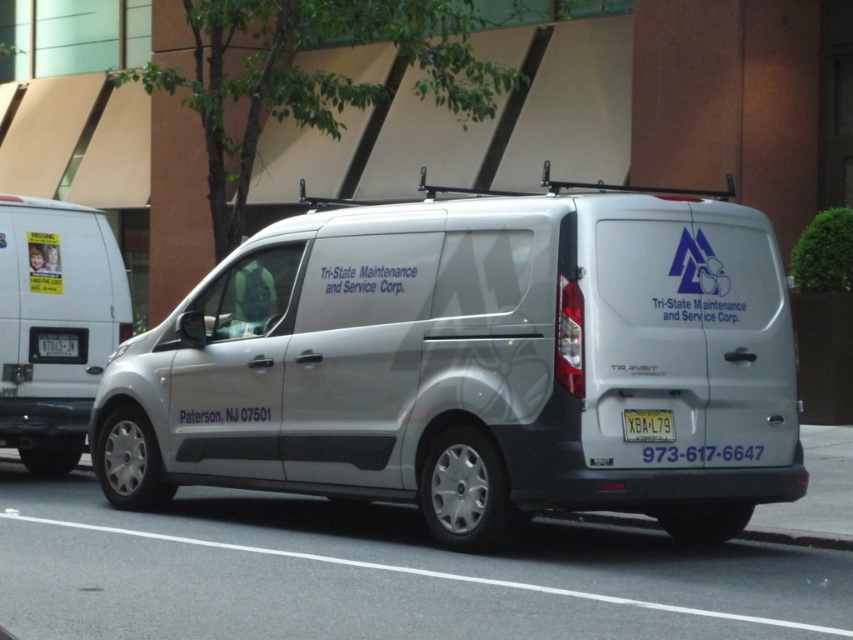
Who is more forward, (x=630, y=228) or (x=84, y=234)?

Point (x=630, y=228) is more forward.

The width and height of the screenshot is (853, 640). I want to click on silver metallic van at center, so click(474, 364).

At what (x,y) coordinates should I click in order to perform the action: click on silver metallic van at center. Please return your answer as a coordinate pair (x, y). The height and width of the screenshot is (640, 853). Looking at the image, I should click on (474, 364).

Who is more forward, (91, 266) or (50, 337)?

Point (50, 337) is in front.

Is white matte van at left closer to the viewer compared to yellow matte license plate at rear?

Yes, white matte van at left is closer to the viewer.

At what (x,y) coordinates should I click in order to perform the action: click on white matte van at left. Please return your answer as a coordinate pair (x, y). The width and height of the screenshot is (853, 640). Looking at the image, I should click on (55, 323).

Who is more forward, (680, 433) or (76, 337)?

Point (680, 433) is in front.

Locate an element on the screen. The image size is (853, 640). silver metallic van at center is located at coordinates (474, 364).

The height and width of the screenshot is (640, 853). I want to click on silver metallic van at center, so click(x=474, y=364).